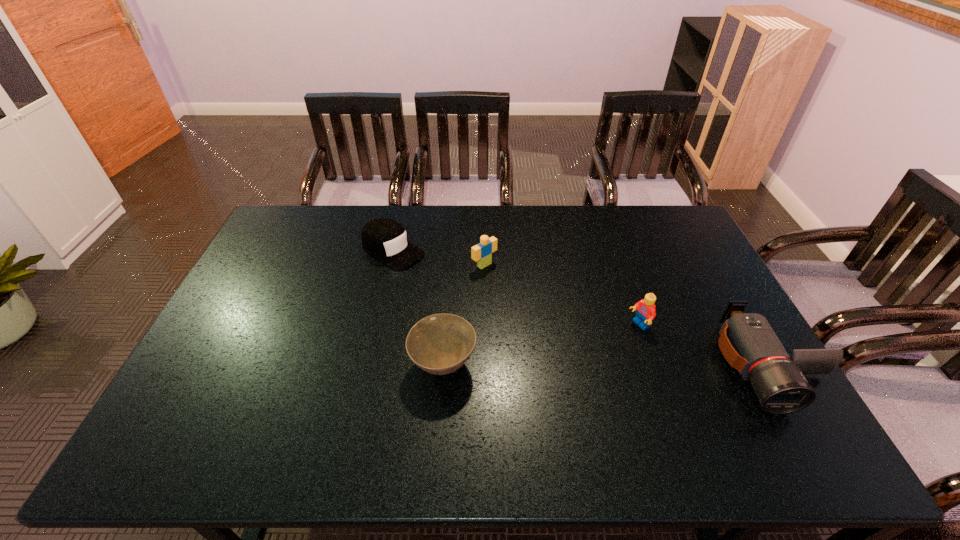
Image resolution: width=960 pixels, height=540 pixels. Identify the location of object that is at the near right corner. (747, 341).

In the image, there is a desktop. Where is `vacant space at the far edge`? This screenshot has height=540, width=960. vacant space at the far edge is located at coordinates (461, 224).

The width and height of the screenshot is (960, 540). Find the location of `vacant position at the near edge of the desktop`. vacant position at the near edge of the desktop is located at coordinates (613, 400).

Find the location of `vacant space at the right edge of the desktop`. vacant space at the right edge of the desktop is located at coordinates (658, 253).

In the image, there is a desktop. Where is `vacant space at the far left corner`? The width and height of the screenshot is (960, 540). vacant space at the far left corner is located at coordinates (316, 212).

Image resolution: width=960 pixels, height=540 pixels. In the image, there is a desktop. Find the location of `free region at the far right corner`. free region at the far right corner is located at coordinates (660, 210).

You are a GUI agent. You are given a task and a screenshot of the screen. Output one action in this format:
    pyautogui.click(x=<x>, y=<y>)
    Task: Click on the empty location between the camcorder and the nearer Lego
    
    Given the screenshot: What is the action you would take?
    pos(703,345)

The height and width of the screenshot is (540, 960). I want to click on vacant point located between the farther Lego and the bowl, so click(x=464, y=315).

Where is `free space between the right Lego and the cap`? free space between the right Lego and the cap is located at coordinates (516, 288).

Identify the location of unoccupied position between the farther Lego and the cap. The image size is (960, 540). (439, 258).